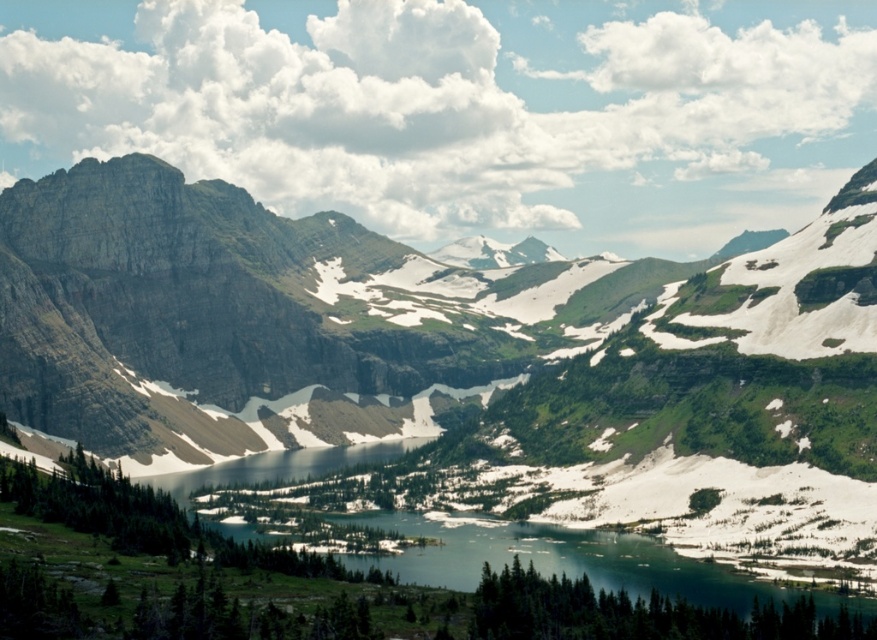
You are a hiker planning to cross the clear blue water at center. Based on the scene, is the rocky mountain range at left visible from the center of the lake?

The rocky mountain range at left is located above clear blue water at center, so yes, it would be visible from the center of the lake.

Consider the image. You are a hiker planning to take a photo of the rocky mountain range at left from the lake shore. Where should you position yourself to capture the entire mountain range in your camera frame?

The rocky mountain range at left is located at point [262,312], so you should position yourself on the lake shore facing towards the left side of the mountains to ensure the entire range fits within your camera frame.